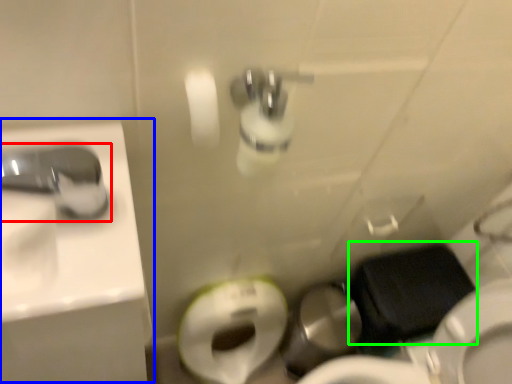
Question: Which object is the farthest from tap (highlighted by a red box)? Choose among these: sink (highlighted by a blue box) or sit (highlighted by a green box).

Choices:
 (A) sink
 (B) sit

Answer: (B)